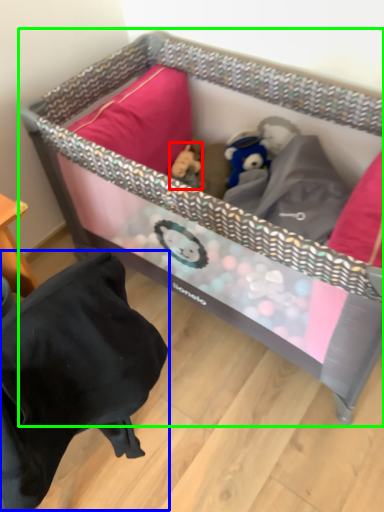
Question: Estimate the real-world distances between objects in this image. Which object is farther from toy (highlighted by a red box), bean bag chair (highlighted by a blue box) or infant bed (highlighted by a green box)?

Choices:
 (A) bean bag chair
 (B) infant bed

Answer: (A)